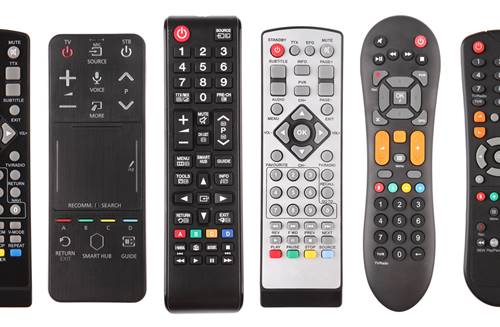
Find the location of `remote`. remote is located at coordinates click(18, 140), click(135, 119), click(217, 125), click(301, 91), click(405, 96), click(487, 131).